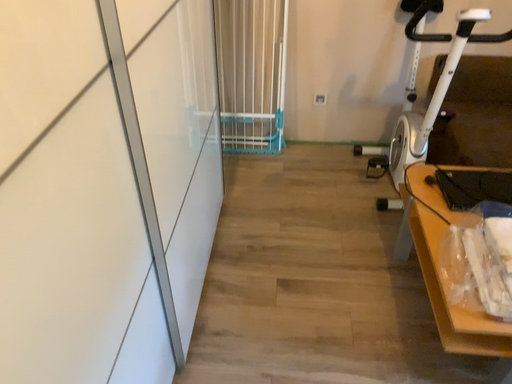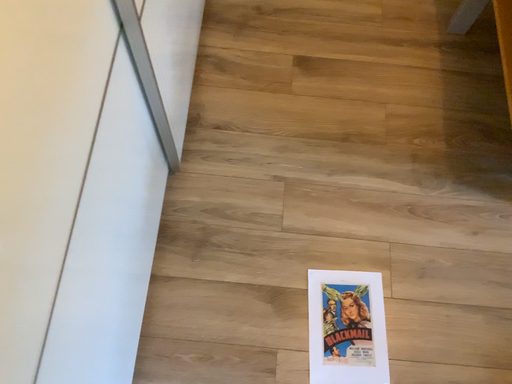
Question: How did the camera likely rotate when shooting the video?

Choices:
 (A) rotated downward
 (B) rotated upward

Answer: (A)